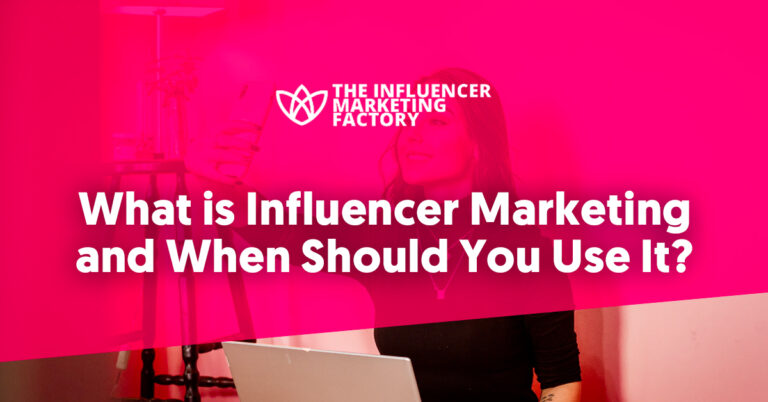
Image resolution: width=768 pixels, height=402 pixels. What are the coordinates of `stool` in the screenshot? It's located at (184, 350).